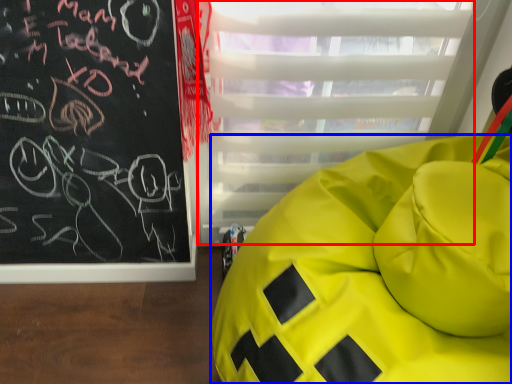
Question: Which point is closer to the camera, glass door (highlighted by a red box) or furniture (highlighted by a blue box)?

Choices:
 (A) glass door
 (B) furniture

Answer: (B)